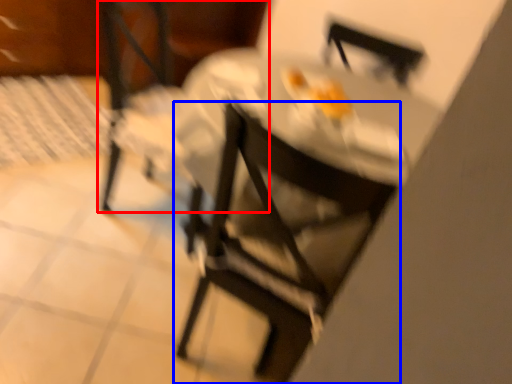
Question: Which of the following is the closest to the observer, chair (highlighted by a red box) or chair (highlighted by a blue box)?

Choices:
 (A) chair
 (B) chair

Answer: (B)